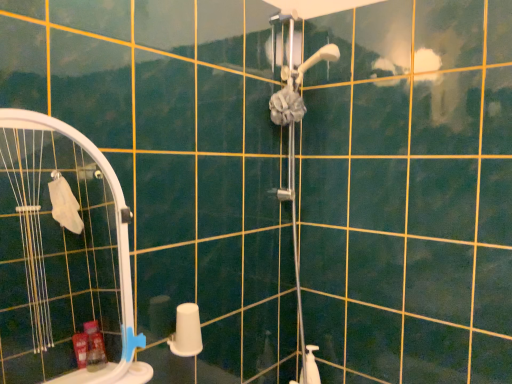
Question: Should I look upward or downward to see blue plastic towel bar at lower left?

Choices:
 (A) up
 (B) down

Answer: (B)

Question: Is matte gray shower door at upper center looking in the opposite direction of white matte toilet paper at lower center?

Choices:
 (A) no
 (B) yes

Answer: (A)

Question: Are matte gray shower door at upper center and white matte toilet paper at lower center far apart?

Choices:
 (A) no
 (B) yes

Answer: (A)

Question: From a real-world perspective, is matte gray shower door at upper center beneath white matte toilet paper at lower center?

Choices:
 (A) no
 (B) yes

Answer: (A)

Question: Is matte gray shower door at upper center thinner than white matte toilet paper at lower center?

Choices:
 (A) no
 (B) yes

Answer: (A)

Question: Considering the relative positions of matte gray shower door at upper center and white matte toilet paper at lower center in the image provided, is matte gray shower door at upper center behind white matte toilet paper at lower center?

Choices:
 (A) no
 (B) yes

Answer: (B)

Question: Is matte gray shower door at upper center oriented towards white matte toilet paper at lower center?

Choices:
 (A) yes
 (B) no

Answer: (B)

Question: Is white plastic screen door at left shorter than white matte toilet paper at lower center?

Choices:
 (A) no
 (B) yes

Answer: (A)

Question: Considering the relative sizes of white plastic screen door at left and white matte toilet paper at lower center in the image provided, is white plastic screen door at left taller than white matte toilet paper at lower center?

Choices:
 (A) no
 (B) yes

Answer: (B)

Question: Considering the relative positions of white plastic screen door at left and white matte toilet paper at lower center in the image provided, is white plastic screen door at left to the left of white matte toilet paper at lower center from the viewer's perspective?

Choices:
 (A) no
 (B) yes

Answer: (B)

Question: Is white plastic screen door at left at the right side of white matte toilet paper at lower center?

Choices:
 (A) yes
 (B) no

Answer: (B)

Question: From the image's perspective, is white plastic screen door at left located beneath white matte toilet paper at lower center?

Choices:
 (A) yes
 (B) no

Answer: (B)

Question: Is white plastic screen door at left facing towards white matte toilet paper at lower center?

Choices:
 (A) no
 (B) yes

Answer: (A)

Question: Can you confirm if white matte toilet paper at lower center is smaller than white plastic screen door at left?

Choices:
 (A) no
 (B) yes

Answer: (B)